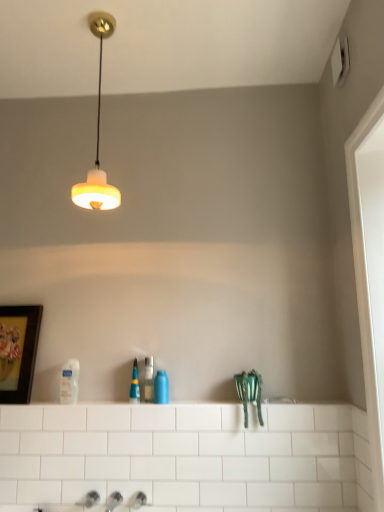
Question: Visually, is blue glossy bottle at center, which is the 1th toiletry in right-to-left order, positioned to the left or to the right of white glossy door at right?

Choices:
 (A) left
 (B) right

Answer: (A)

Question: From the image's perspective, is blue glossy bottle at center, which is the 1th toiletry in right-to-left order, located above or below white glossy door at right?

Choices:
 (A) above
 (B) below

Answer: (B)

Question: Which of these objects is positioned farthest from the white glossy door at right?

Choices:
 (A) translucent plastic bottle at center, marked as the 2th toiletry in a right-to-left arrangement
 (B) white glossy lotion at lower left, arranged as the first toiletry when viewed from the left
 (C) blue glossy bottle at center, which is the third toiletry in left-to-right order
 (D) white glossy ledge at center
 (E) wooden framed artwork at left

Answer: (E)

Question: Based on their relative distances, which object is nearer to the white glossy door at right?

Choices:
 (A) white glossy ledge at center
 (B) translucent plastic bottle at center, the second toiletry from the left
 (C) wooden framed artwork at left
 (D) white glossy lotion at lower left, arranged as the first toiletry when viewed from the left
 (E) matte white lampshade at upper center

Answer: (A)